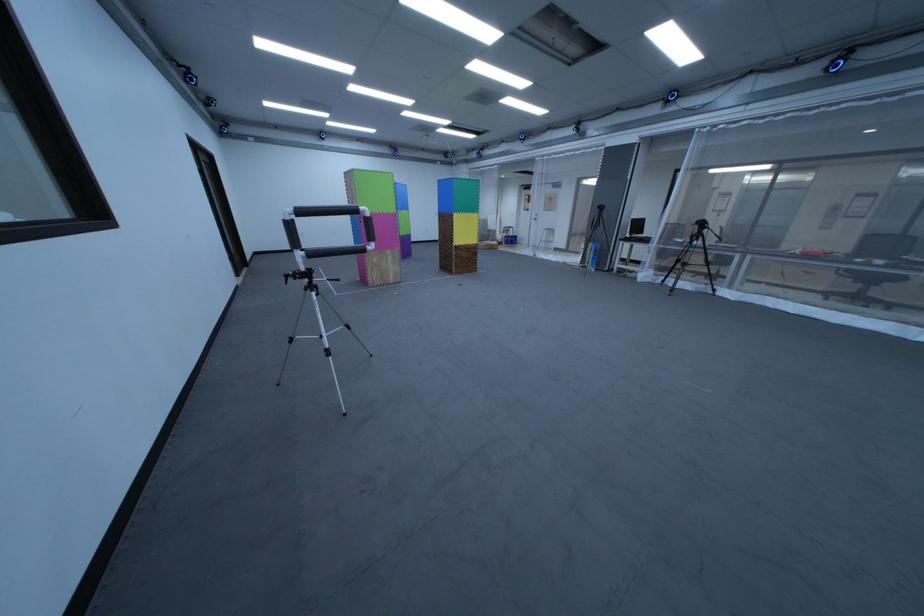
Find the location of a particular element. This screenshot has height=616, width=924. yellow foam block is located at coordinates (465, 228).